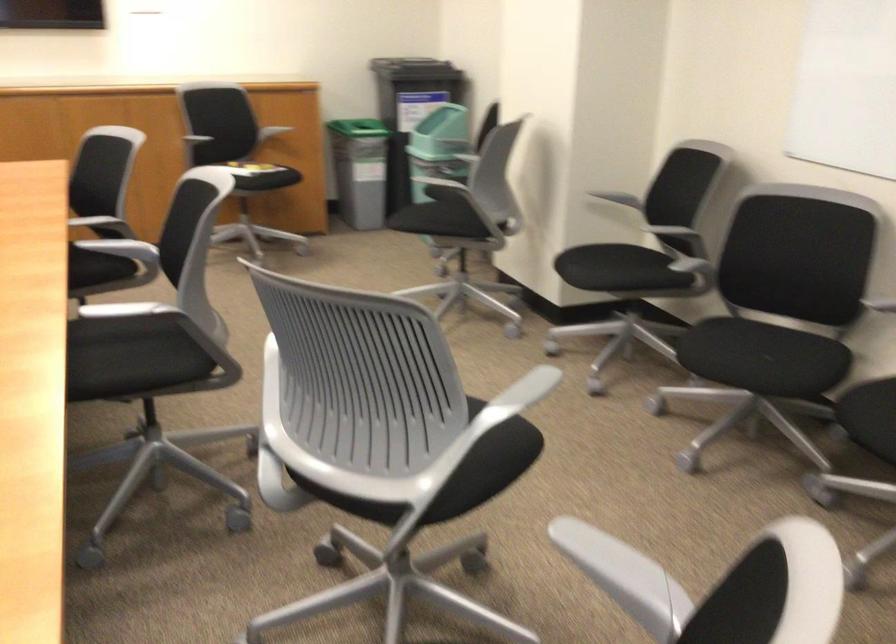
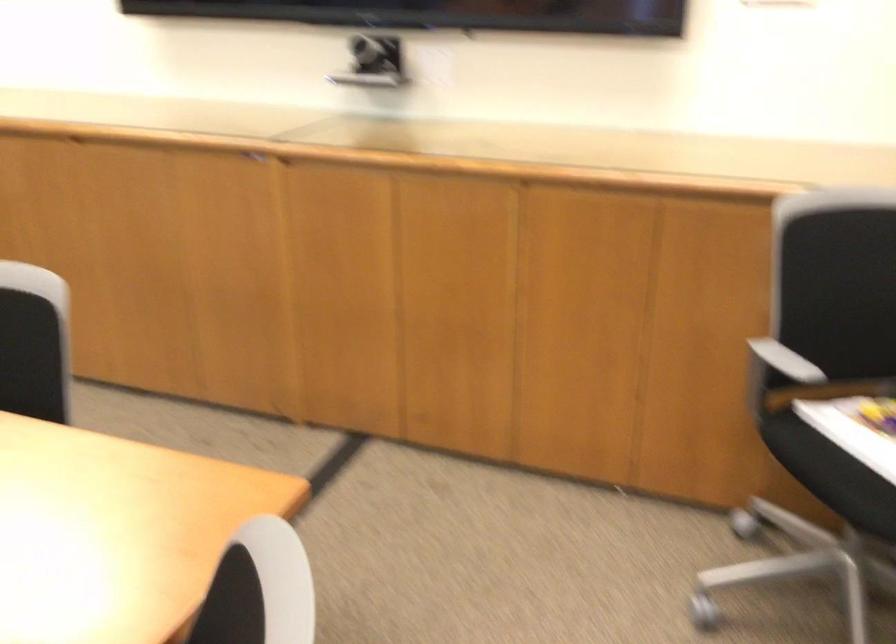
The point at (202, 126) is marked in the first image. Where is the corresponding point in the second image?

(778, 374)